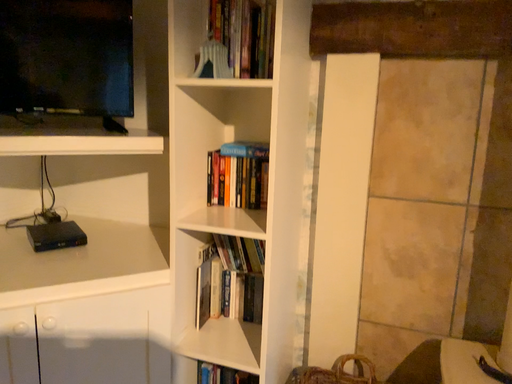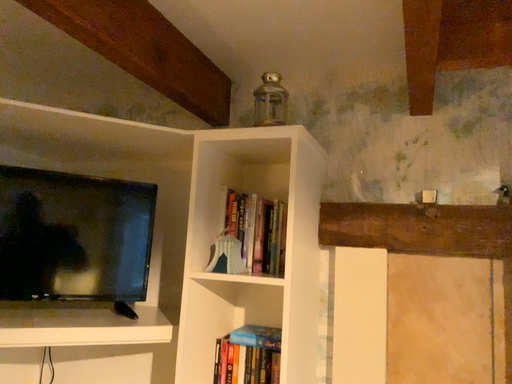
Question: Which way did the camera rotate in the video?

Choices:
 (A) rotated downward
 (B) rotated upward

Answer: (B)